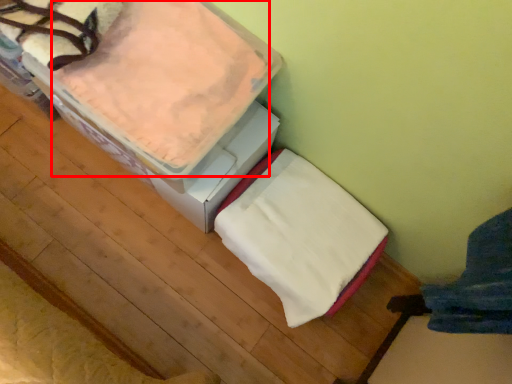
Question: In this image, where is sheet (annotated by the red box) located relative to blanket?

Choices:
 (A) left
 (B) right

Answer: (A)